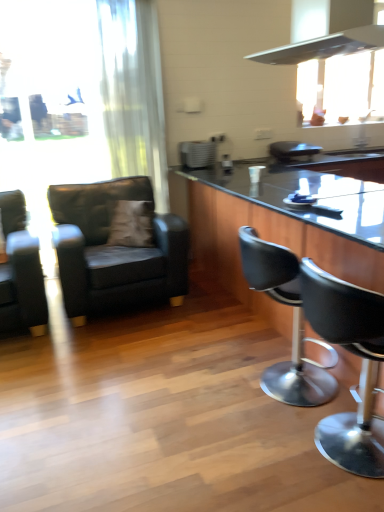
What do you see at coordinates (131, 224) in the screenshot? Image resolution: width=384 pixels, height=512 pixels. I see `brown suede pillow at center` at bounding box center [131, 224].

Identify the location of matte black armchair at left, marked as the 3th chair in a right-to-left arrangement. The height and width of the screenshot is (512, 384). (114, 249).

This screenshot has width=384, height=512. I want to click on matte black armchair at left, the 1th chair when ordered from left to right, so click(x=20, y=271).

This screenshot has width=384, height=512. What do you see at coordinates (293, 323) in the screenshot?
I see `black leather bar stool at center, the third chair from the left` at bounding box center [293, 323].

The image size is (384, 512). I want to click on metallic silver range hood at upper right, so click(332, 36).

Based on the photo, how many degrees apart are the facing directions of metallic silver range hood at upper right and black glossy table at center?

metallic silver range hood at upper right and black glossy table at center are facing 90.3 degrees away from each other.

Is metallic silver range hood at upper right facing towards black glossy table at center?

No, metallic silver range hood at upper right does not turn towards black glossy table at center.

Would you say metallic silver range hood at upper right is outside black glossy table at center?

That's correct, metallic silver range hood at upper right is outside of black glossy table at center.

Considering the positions of objects metallic silver range hood at upper right and black glossy table at center in the image provided, who is more to the left, metallic silver range hood at upper right or black glossy table at center?

metallic silver range hood at upper right.

Looking at this image, is matte black armchair at left, the 1th chair when ordered from left to right, at the back of black glossy table at center?

That's not correct — black glossy table at center is not looking away from matte black armchair at left, the 1th chair when ordered from left to right.

From the image's perspective, which object appears higher, black glossy table at center or matte black armchair at left, the 1th chair when ordered from left to right?

From the image's view, black glossy table at center is above.

Does black glossy table at center have a smaller size compared to matte black armchair at left, the 1th chair when ordered from left to right?

No.

From a real-world perspective, which object stands above the other?

white sheer curtain at left, from a real-world perspective.

Is white sheer curtain at left far away from black glossy countertop at center?

They are positioned close to each other.

Can we say white sheer curtain at left lies outside black glossy countertop at center?

Yes, white sheer curtain at left is not within black glossy countertop at center.

From the image's perspective, is white sheer curtain at left under black glossy countertop at center?

No, from the image's perspective, white sheer curtain at left is not below black glossy countertop at center.

How different are the orientations of black glossy countertop at center and satin silver toaster at center in degrees?

They differ by 87.9 degrees in their facing directions.

How far apart are black glossy countertop at center and satin silver toaster at center?

They are 12.26 inches apart.

Identify the location of appliance above the black glossy countertop at center (from the image's perspective). (197, 154).

Is black glossy countertop at center facing away from satin silver toaster at center?

That's not correct — black glossy countertop at center is not looking away from satin silver toaster at center.

Is the surface of black leather bar stool at center, positioned as the 2th chair in right-to-left order, in direct contact with satin silver toaster at center?

black leather bar stool at center, positioned as the 2th chair in right-to-left order, is not next to satin silver toaster at center, and they're not touching.

Does black leather bar stool at center, the third chair from the left, come behind satin silver toaster at center?

No, black leather bar stool at center, the third chair from the left, is closer to the viewer.

Is satin silver toaster at center at the back of black leather bar stool at center, the third chair from the left?

No.

Is black leather bar stool at center, positioned as the 2th chair in right-to-left order, taller or shorter than satin silver toaster at center?

black leather bar stool at center, positioned as the 2th chair in right-to-left order, is taller than satin silver toaster at center.

Is brown suede pillow at center to the left or to the right of black glossy table at center in the image?

brown suede pillow at center is positioned on black glossy table at center's left side.

Could you tell me if brown suede pillow at center is turned towards black glossy table at center?

No.

From a real-world perspective, which is physically above, brown suede pillow at center or black glossy table at center?

From a 3D spatial view, brown suede pillow at center is above.

Considering the sizes of brown suede pillow at center and black glossy table at center in the image, is brown suede pillow at center bigger or smaller than black glossy table at center?

Result: brown suede pillow at center is smaller than black glossy table at center.

Which of these two, black glossy countertop at center or black leather bar stool at center, the third chair from the left, is wider?

With larger width is black glossy countertop at center.

From the image's perspective, is black glossy countertop at center under black leather bar stool at center, positioned as the 2th chair in right-to-left order?

Incorrect, from the image's perspective, black glossy countertop at center is higher than black leather bar stool at center, positioned as the 2th chair in right-to-left order.

There is a black glossy countertop at center. Where is `the 3rd chair below it (from a real-world perspective)`? This screenshot has width=384, height=512. the 3rd chair below it (from a real-world perspective) is located at coordinates (293, 323).

Is black glossy countertop at center not close to black leather bar stool at center, positioned as the 2th chair in right-to-left order?

Yes, black glossy countertop at center and black leather bar stool at center, positioned as the 2th chair in right-to-left order, are quite far apart.

This screenshot has width=384, height=512. What are the coordinates of `table that appears in front of the metallic silver range hood at upper right` in the screenshot? It's located at (272, 232).

This screenshot has height=512, width=384. Identify the location of chair that is the 1st one below the black glossy table at center (from a real-world perspective). (20, 271).

From the image, which object appears to be farther from satin silver toaster at center, matte black armchair at left, positioned as the second chair in left-to-right order, or black glossy countertop at center?

The object further to satin silver toaster at center is matte black armchair at left, positioned as the second chair in left-to-right order.

In the scene shown: From the image, which object appears to be nearer to black leather bar stool at center, the third chair from the left, matte black armchair at left, marked as the 3th chair in a right-to-left arrangement, or white sheer curtain at left?

The object closer to black leather bar stool at center, the third chair from the left, is matte black armchair at left, marked as the 3th chair in a right-to-left arrangement.

Which object lies nearer to the anchor point black glossy table at center, matte black armchair at left, marked as the 3th chair in a right-to-left arrangement, or black leather bar stool at right, which appears as the fourth chair when viewed from the left?

matte black armchair at left, marked as the 3th chair in a right-to-left arrangement.

Considering their positions, is black glossy countertop at center positioned closer to brown suede pillow at center than white sheer curtain at left?

black glossy countertop at center lies closer to brown suede pillow at center than the other object.

Based on their spatial positions, is black leather bar stool at center, positioned as the 2th chair in right-to-left order, or white sheer curtain at left further from metallic silver range hood at upper right?

black leather bar stool at center, positioned as the 2th chair in right-to-left order, lies further to metallic silver range hood at upper right than the other object.

From the image, which object appears to be nearer to matte black armchair at left, positioned as the second chair in left-to-right order, black glossy table at center or matte black armchair at left, the 1th chair when ordered from left to right?

matte black armchair at left, the 1th chair when ordered from left to right, lies closer to matte black armchair at left, positioned as the second chair in left-to-right order, than the other object.

Looking at the image, which one is located closer to matte black armchair at left, marked as the 3th chair in a right-to-left arrangement, metallic silver range hood at upper right or black glossy table at center?

black glossy table at center is closer to matte black armchair at left, marked as the 3th chair in a right-to-left arrangement.

Which object lies nearer to the anchor point metallic silver range hood at upper right, satin silver toaster at center or brown suede pillow at center?

brown suede pillow at center is closer to metallic silver range hood at upper right.

The width and height of the screenshot is (384, 512). Find the location of `pillow between matte black armchair at left, the 1th chair when ordered from left to right, and satin silver toaster at center from left to right`. pillow between matte black armchair at left, the 1th chair when ordered from left to right, and satin silver toaster at center from left to right is located at coordinates (131, 224).

The width and height of the screenshot is (384, 512). I want to click on pillow between matte black armchair at left, the 4th chair when ordered from right to left, and metallic silver range hood at upper right, in the horizontal direction, so tap(131, 224).

Locate an element on the screen. The image size is (384, 512). chair between matte black armchair at left, the 4th chair when ordered from right to left, and satin silver toaster at center from left to right is located at coordinates (114, 249).

Identify the location of pillow between white sheer curtain at left and metallic silver range hood at upper right. (131, 224).